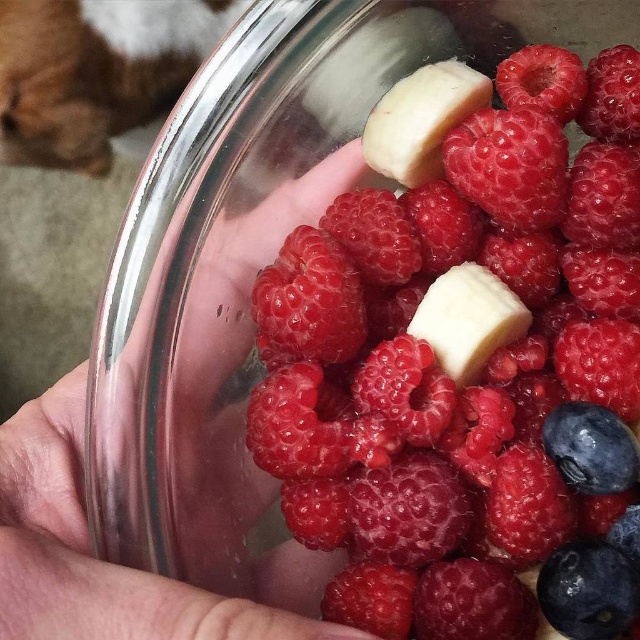
From the picture: Does glossy red raspberry at center have a lesser width compared to smooth skin hand at center?

In fact, glossy red raspberry at center might be wider than smooth skin hand at center.

Can you confirm if glossy red raspberry at center is smaller than smooth skin hand at center?

No, glossy red raspberry at center is not smaller than smooth skin hand at center.

This screenshot has height=640, width=640. What are the coordinates of `glossy red raspberry at center` in the screenshot? It's located at (470, 371).